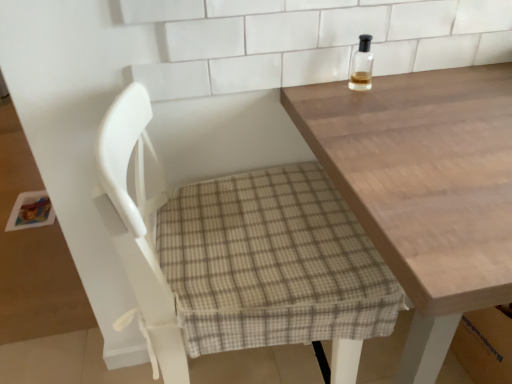
The image size is (512, 384). Describe the element at coordinates (361, 65) in the screenshot. I see `clear glass bottle at upper right` at that location.

This screenshot has height=384, width=512. What do you see at coordinates (239, 255) in the screenshot?
I see `white fabric chair at center` at bounding box center [239, 255].

Where is `white fabric chair at center`? Image resolution: width=512 pixels, height=384 pixels. white fabric chair at center is located at coordinates (239, 255).

You are a GUI agent. You are given a task and a screenshot of the screen. Output one action in this format:
    pyautogui.click(x=<x>, y=<y>)
    Task: Click on the clear glass bottle at upper right
    This screenshot has width=512, height=384.
    Given the screenshot: What is the action you would take?
    pyautogui.click(x=361, y=65)

From their relative heights in the image, would you say light brown wooden table at upper right is taller or shorter than white fabric chair at center?

light brown wooden table at upper right is shorter than white fabric chair at center.

In the scene shown: Are light brown wooden table at upper right and white fabric chair at center making contact?

No.

From the image's perspective, is light brown wooden table at upper right above white fabric chair at center?

Yes.

What are the coordinates of `chair lying on the left of light brown wooden table at upper right` in the screenshot? It's located at (239, 255).

Could light brown wooden table at upper right be considered to be inside clear glass bottle at upper right?

No, light brown wooden table at upper right is not surrounded by clear glass bottle at upper right.

In the scene shown: Is clear glass bottle at upper right far away from light brown wooden table at upper right?

clear glass bottle at upper right is near light brown wooden table at upper right, not far away.

What's the angular difference between clear glass bottle at upper right and light brown wooden table at upper right's facing directions?

The angle between the facing direction of clear glass bottle at upper right and the facing direction of light brown wooden table at upper right is 4.1 degrees.

Does clear glass bottle at upper right turn towards light brown wooden table at upper right?

No, clear glass bottle at upper right is not oriented towards light brown wooden table at upper right.

Between light brown wooden table at upper right and clear glass bottle at upper right, which one has larger size?

Bigger between the two is light brown wooden table at upper right.

How many degrees apart are the facing directions of light brown wooden table at upper right and clear glass bottle at upper right?

The facing directions of light brown wooden table at upper right and clear glass bottle at upper right are 4.1 degrees apart.

Measure the distance between light brown wooden table at upper right and clear glass bottle at upper right.

The distance of light brown wooden table at upper right from clear glass bottle at upper right is 10.59 inches.

Do you think light brown wooden table at upper right is within clear glass bottle at upper right, or outside of it?

light brown wooden table at upper right lies outside clear glass bottle at upper right.

Looking at this image, between clear glass bottle at upper right and white fabric chair at center, which one has smaller width?

With smaller width is clear glass bottle at upper right.

How many degrees apart are the facing directions of clear glass bottle at upper right and white fabric chair at center?

There is a 94.1-degree angle between the facing directions of clear glass bottle at upper right and white fabric chair at center.

From a real-world perspective, which object stands above the other?

From a 3D spatial view, clear glass bottle at upper right is above.

Can we say white fabric chair at center lies outside light brown wooden table at upper right?

No, white fabric chair at center is not outside of light brown wooden table at upper right.

Could you tell me if white fabric chair at center is turned towards light brown wooden table at upper right?

Yes.

Would you say white fabric chair at center is to the left or to the right of light brown wooden table at upper right in the picture?

Clearly, white fabric chair at center is on the left of light brown wooden table at upper right in the image.

From the image's perspective, which one is positioned higher, white fabric chair at center or light brown wooden table at upper right?

light brown wooden table at upper right is shown above in the image.

Is white fabric chair at center facing towards clear glass bottle at upper right?

Yes.

Which of these two, white fabric chair at center or clear glass bottle at upper right, is smaller?

Smaller between the two is clear glass bottle at upper right.

This screenshot has width=512, height=384. Identify the location of bottle that is above the white fabric chair at center (from the image's perspective). (361, 65).

Is white fabric chair at center not close to clear glass bottle at upper right?

They are positioned close to each other.

The image size is (512, 384). What are the coordinates of `chair behind the light brown wooden table at upper right` in the screenshot? It's located at (239, 255).

This screenshot has height=384, width=512. Find the location of `bottle on the left of light brown wooden table at upper right`. bottle on the left of light brown wooden table at upper right is located at coordinates (361, 65).

When comparing their distances from light brown wooden table at upper right, does clear glass bottle at upper right or white fabric chair at center seem closer?

Among the two, white fabric chair at center is located nearer to light brown wooden table at upper right.

When comparing their distances from clear glass bottle at upper right, does light brown wooden table at upper right or white fabric chair at center seem closer?

The object closer to clear glass bottle at upper right is light brown wooden table at upper right.

Estimate the real-world distances between objects in this image. Which object is further from white fabric chair at center, light brown wooden table at upper right or clear glass bottle at upper right?

clear glass bottle at upper right is positioned further to the anchor white fabric chair at center.

Estimate the real-world distances between objects in this image. Which object is further from clear glass bottle at upper right, white fabric chair at center or light brown wooden table at upper right?

Among the two, white fabric chair at center is located further to clear glass bottle at upper right.

Looking at the image, which one is located further to white fabric chair at center, clear glass bottle at upper right or light brown wooden table at upper right?

clear glass bottle at upper right.

Looking at the image, which one is located closer to light brown wooden table at upper right, white fabric chair at center or clear glass bottle at upper right?

The object closer to light brown wooden table at upper right is white fabric chair at center.

The width and height of the screenshot is (512, 384). Identify the location of table between clear glass bottle at upper right and white fabric chair at center from top to bottom. (424, 188).